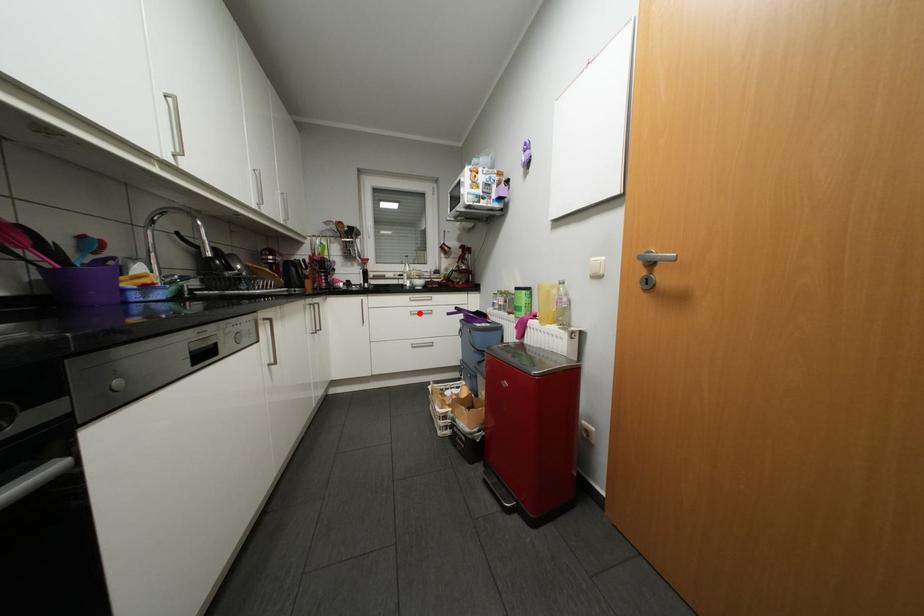
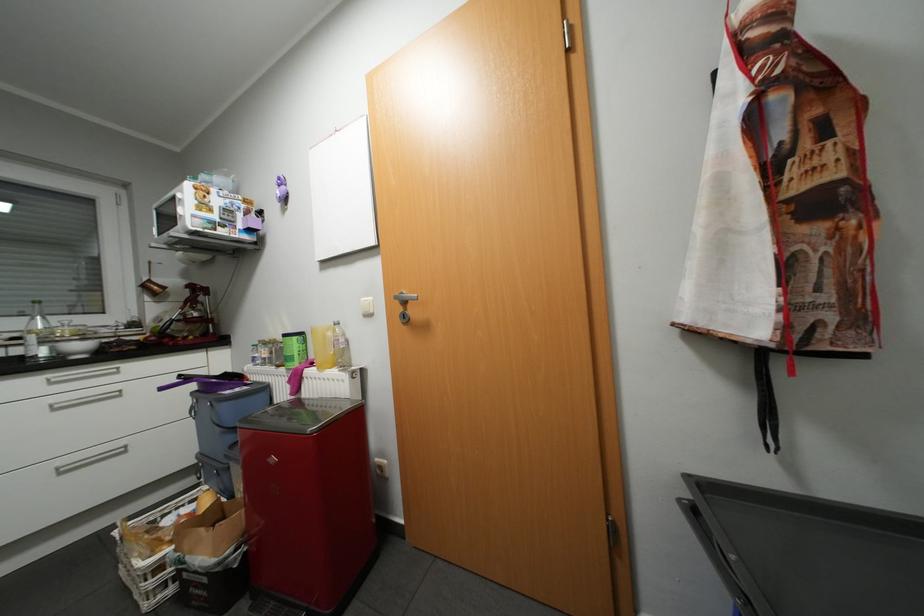
Question: I am providing you with two images of the same scene from different viewpoints. Given a red point in image1, look at the same physical point in image2. Is it:

Choices:
 (A) Closer to the viewpoint
 (B) Farther from the viewpoint

Answer: (A)